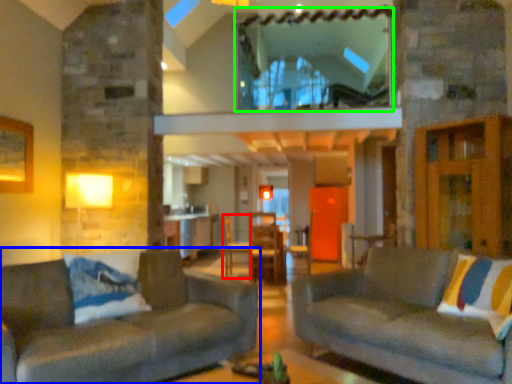
Question: Which object is positioned closest to armchair (highlighted by a red box)? Select from studio couch (highlighted by a blue box) and window (highlighted by a green box).

Choices:
 (A) studio couch
 (B) window

Answer: (B)